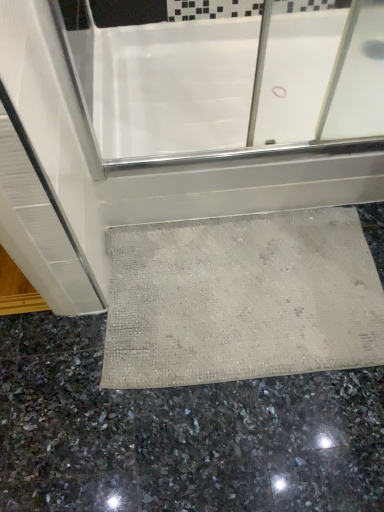
Question: From the image's perspective, is gray polished granite at lower center above or below white glossy bathtub at center?

Choices:
 (A) above
 (B) below

Answer: (B)

Question: Would you say gray polished granite at lower center is to the left or to the right of white glossy bathtub at center in the picture?

Choices:
 (A) right
 (B) left

Answer: (B)

Question: Estimate the real-world distances between objects in this image. Which object is farther from the gray polished granite at lower center?

Choices:
 (A) white glossy bathtub at center
 (B) beige textured bath mat at lower center

Answer: (A)

Question: Considering the real-world distances, which object is farthest from the white glossy bathtub at center?

Choices:
 (A) beige textured bath mat at lower center
 (B) gray polished granite at lower center

Answer: (B)